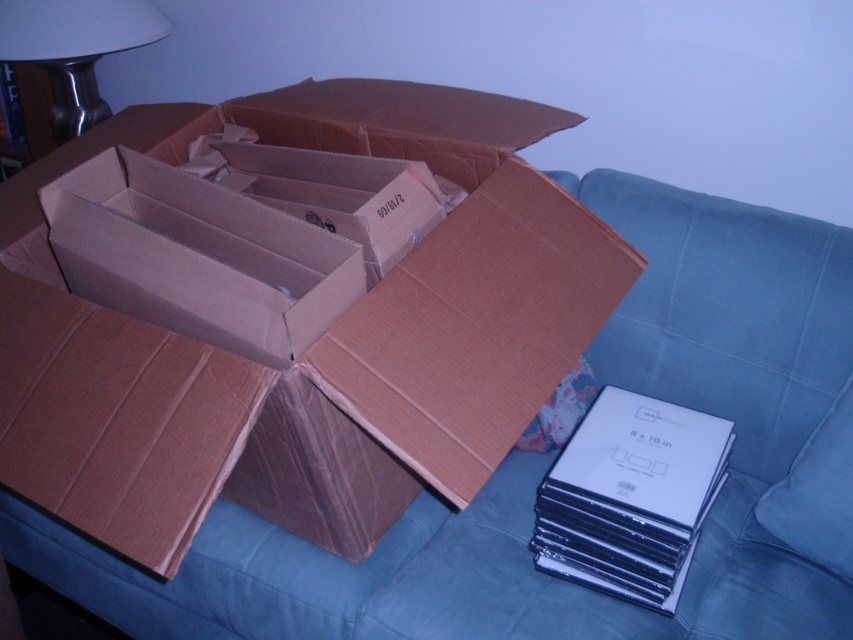
You are organizing items in the living room and need to place a new decoration. The decoration is 1 meter tall. Can you place it on top of the brown corrugated cardboard box at center without it touching the white matte lampshade at upper left?

The brown corrugated cardboard box at center is closer to the viewer than the white matte lampshade at upper left. Since the box is closer, placing the decoration on top of it would not interfere with the lampshade as they are at different depths. The height of the decoration is 1 meter, but the vertical distance between the box and lampshade isn

You are organizing items in the living room and need to place the brown corrugated cardboard box at center and the white matte lampshade at upper left on a shelf. Which object requires a taller shelf space?

The brown corrugated cardboard box at center requires a taller shelf space because it is much taller than the white matte lampshade at upper left.